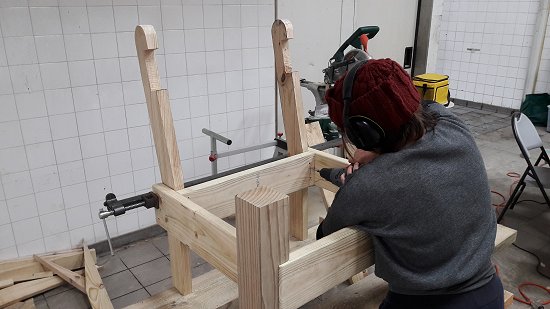
The width and height of the screenshot is (550, 309). What are the coordinates of `wooden frame` in the screenshot? It's located at (270, 246).